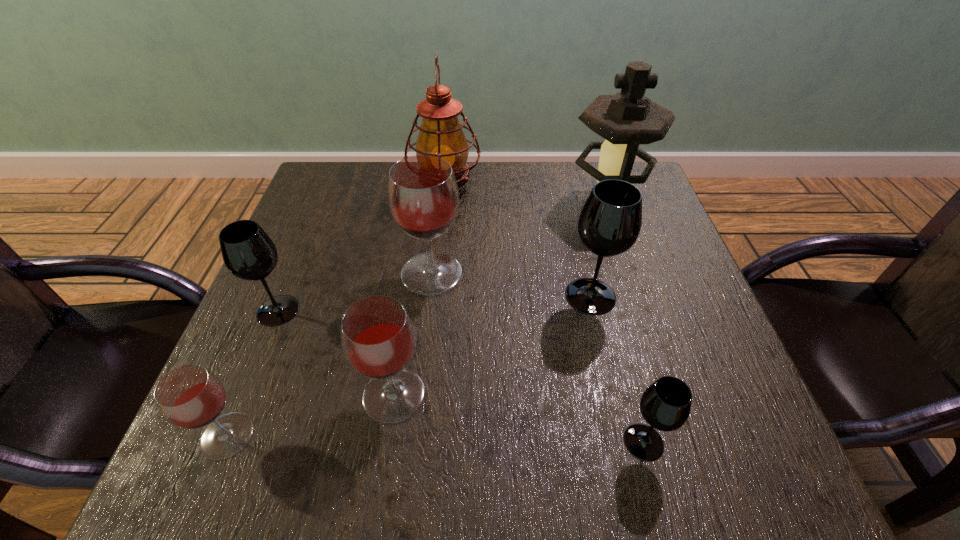
This screenshot has height=540, width=960. In order to click on object at the near right corner in this screenshot , I will do `click(665, 405)`.

I want to click on free space at the near edge, so click(564, 432).

You are a GUI agent. You are given a task and a screenshot of the screen. Output one action in this format:
    pyautogui.click(x=<x>, y=<y>)
    Task: Click on the free region at the left edge
    
    Given the screenshot: What is the action you would take?
    pyautogui.click(x=251, y=338)

The image size is (960, 540). I want to click on free location at the right edge of the desktop, so 666,289.

This screenshot has width=960, height=540. In order to click on free location at the near left corner in this screenshot , I will do `click(287, 443)`.

The height and width of the screenshot is (540, 960). I want to click on free space between the smallest gray wineglass and the second biggest gray wineglass, so click(461, 376).

The image size is (960, 540). Identify the location of free spot between the right oil lamp and the biggest red wineglass. (519, 238).

Locate an element on the screen. The image size is (960, 540). vacant space that's between the right oil lamp and the second biggest red wineglass is located at coordinates (500, 299).

Identify the location of vacant point located between the nearest gray wineglass and the left oil lamp. The height and width of the screenshot is (540, 960). (544, 315).

Locate an element on the screen. Image resolution: width=960 pixels, height=540 pixels. unoccupied position between the right oil lamp and the smallest gray wineglass is located at coordinates (625, 322).